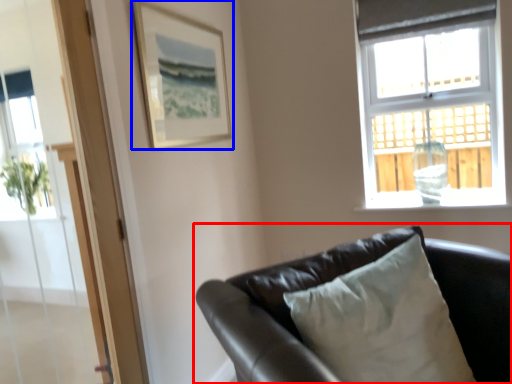
Question: Which object appears closest to the camera in this image, studio couch (highlighted by a red box) or picture frame (highlighted by a blue box)?

Choices:
 (A) studio couch
 (B) picture frame

Answer: (A)